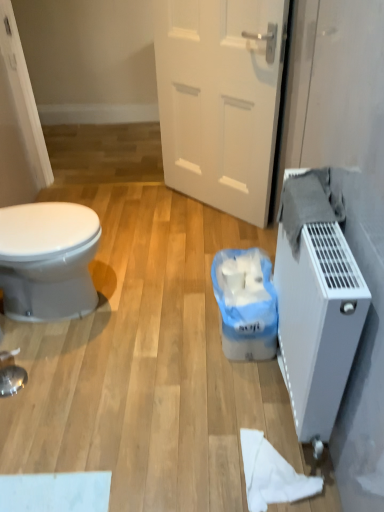
Find the location of a particular element. free space between white plastic bag at lower center and white matte toilet paper at lower right is located at coordinates (245, 398).